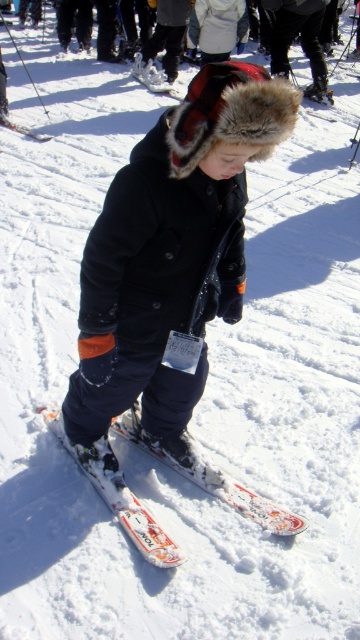
Question: Can you confirm if dark blue fleece jacket at center is positioned to the right of white matte ski at center?

Choices:
 (A) yes
 (B) no

Answer: (A)

Question: Estimate the real-world distances between objects in this image. Which object is farther from the white plastic ski at lower center?

Choices:
 (A) white glossy skis at center
 (B) dark blue fleece jacket at center

Answer: (B)

Question: Can you confirm if dark blue fleece jacket at center is positioned to the right of white matte ski at center?

Choices:
 (A) yes
 (B) no

Answer: (A)

Question: Among these points, which one is farthest from the camera?

Choices:
 (A) (104, 451)
 (B) (253, 492)
 (C) (29, 131)
 (D) (144, 61)

Answer: (D)

Question: Is dark blue fleece jacket at center behind white glossy skis at center?

Choices:
 (A) no
 (B) yes

Answer: (A)

Question: Which object is positioned closest to the white glossy skis at center?

Choices:
 (A) white matte ski at center
 (B) dark blue fleece jacket at center
 (C) white plastic ski at lower center

Answer: (B)